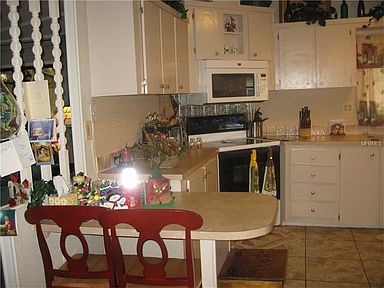
Image resolution: width=384 pixels, height=288 pixels. Identify the location of white kitchen cupboard door. (360, 171).